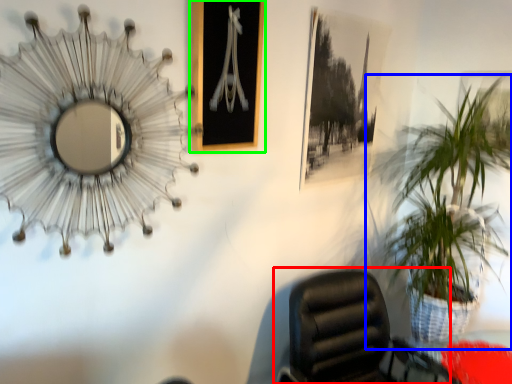
Question: Which object is positioned closest to chair (highlighted by a red box)? Select from houseplant (highlighted by a blue box) and picture frame (highlighted by a green box).

Choices:
 (A) houseplant
 (B) picture frame

Answer: (A)